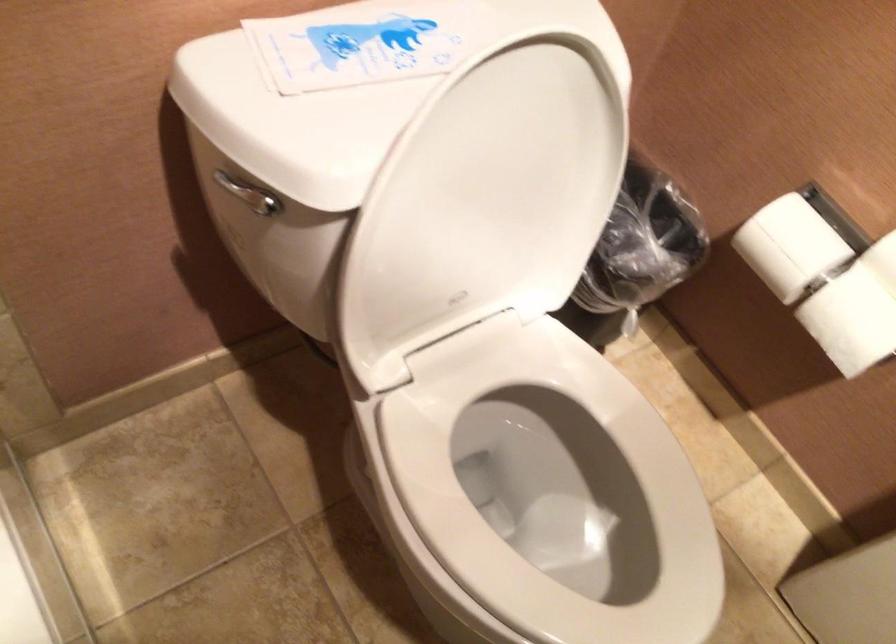
Based on the continuous images, in which direction is the camera rotating?

The rotation direction of the camera is right-up.